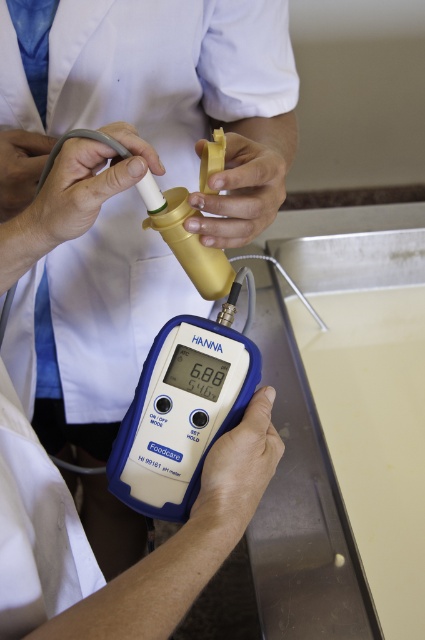
Question: Based on their relative distances, which object is farther from the matte gold tube at center?

Choices:
 (A) matte yellow tube at center
 (B) matte white tube at center
 (C) matte blue digital meter at lower center

Answer: (C)

Question: Is blue plastic scale at center thinner than matte yellow tube at center?

Choices:
 (A) yes
 (B) no

Answer: (B)

Question: Where is blue plastic scale at center located in relation to matte blue digital meter at lower center in the image?

Choices:
 (A) above
 (B) below

Answer: (A)

Question: Which point is closer to the camera?

Choices:
 (A) matte yellow tube at center
 (B) matte white tube at center
 (C) matte blue digital meter at lower center

Answer: (C)

Question: Is matte yellow tube at center positioned before matte blue digital meter at lower center?

Choices:
 (A) yes
 (B) no

Answer: (B)

Question: Estimate the real-world distances between objects in this image. Which object is farther from the matte gold tube at center?

Choices:
 (A) matte yellow tube at center
 (B) blue plastic scale at center

Answer: (B)